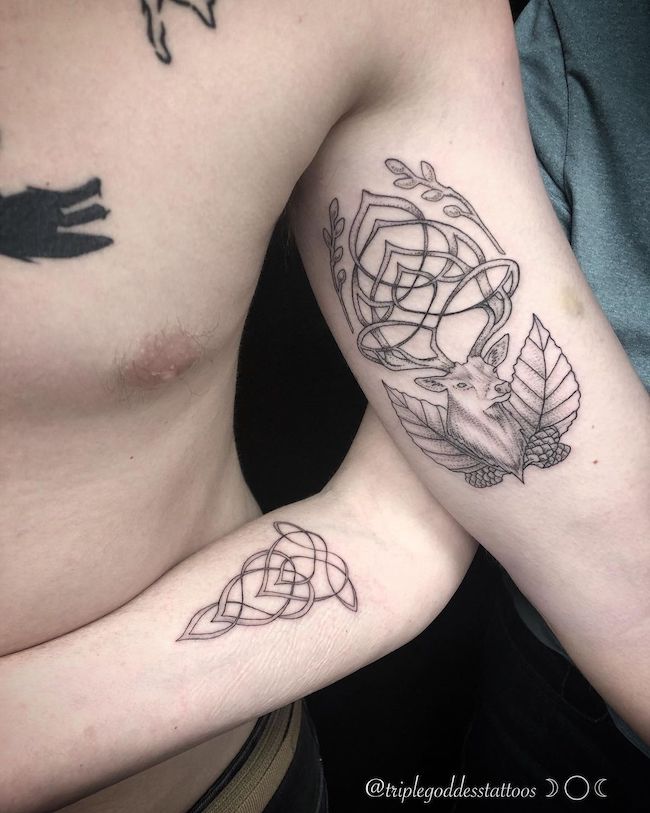
Locate an element on the screen. This screenshot has width=650, height=813. deer head is located at coordinates (470, 393).